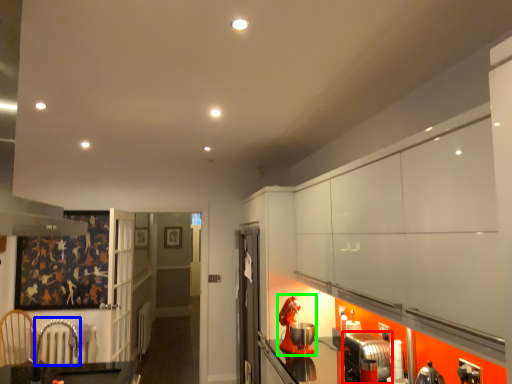
Question: Considering the real-world distances, which object is farthest from appliance (highlighted by a red box)? armchair (highlighted by a blue box) or appliance (highlighted by a green box)?

Choices:
 (A) armchair
 (B) appliance

Answer: (A)